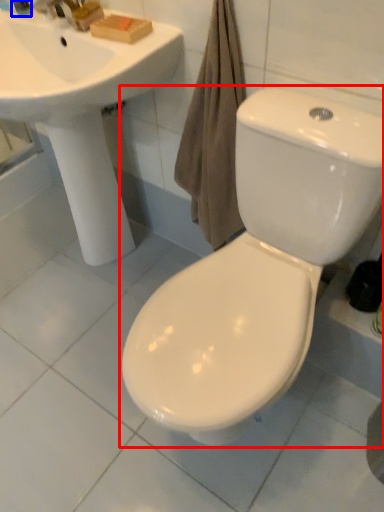
Question: Which object is closer to the camera taking this photo, toilet (highlighted by a red box) or toiletry (highlighted by a blue box)?

Choices:
 (A) toilet
 (B) toiletry

Answer: (A)